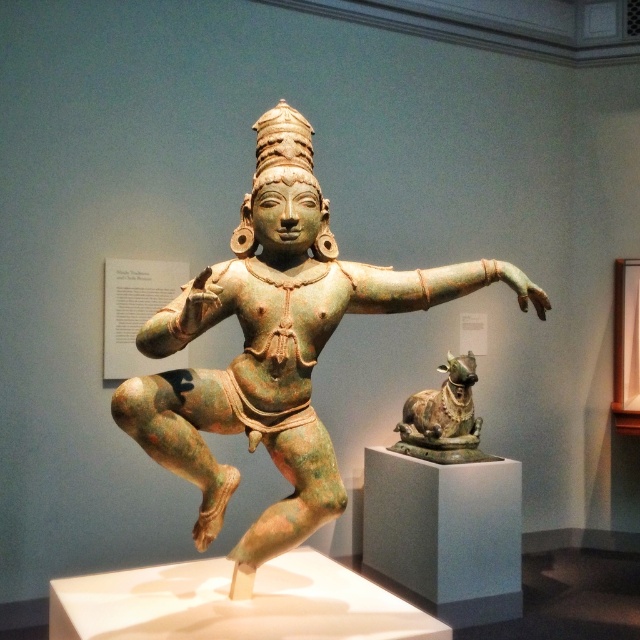
Does green patinated bronze statue at center appear under green patinated bronze bull at center?

No.

Can you confirm if green patinated bronze statue at center is taller than green patinated bronze bull at center?

Indeed, green patinated bronze statue at center has a greater height compared to green patinated bronze bull at center.

What do you see at coordinates (275, 348) in the screenshot?
I see `green patinated bronze statue at center` at bounding box center [275, 348].

You are a GUI agent. You are given a task and a screenshot of the screen. Output one action in this format:
    pyautogui.click(x=<x>, y=<y>)
    Task: Click on the green patinated bronze statue at center
    The width and height of the screenshot is (640, 640).
    Given the screenshot: What is the action you would take?
    pyautogui.click(x=275, y=348)